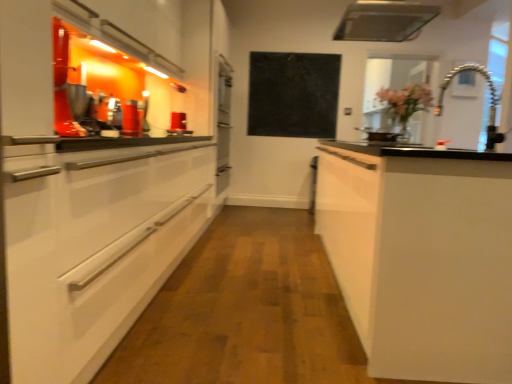
The width and height of the screenshot is (512, 384). Identify the location of vacant space positioned to the left of white matte cabinet at right. (247, 286).